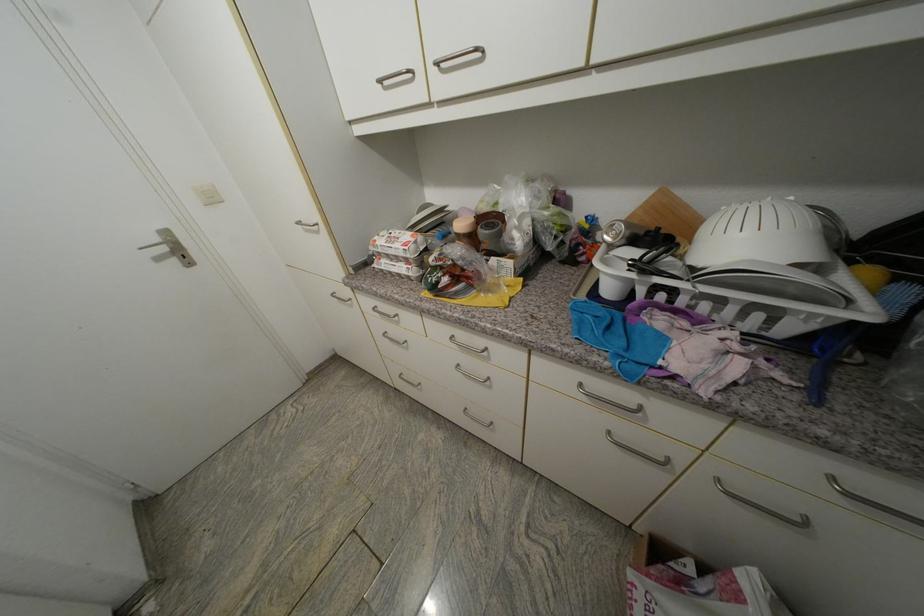
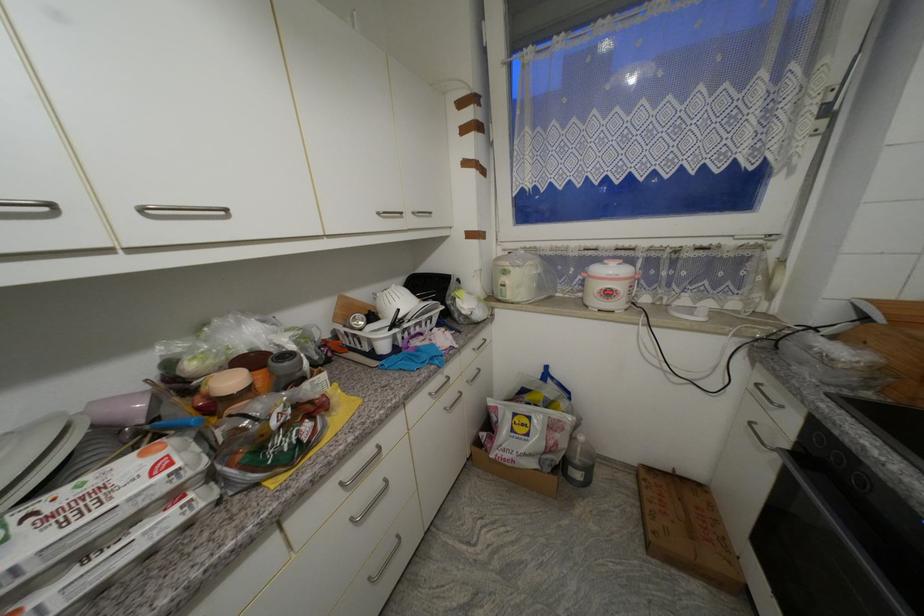
In the second image, find the point that corresponds to pixel 710 310 in the first image.

(423, 331)